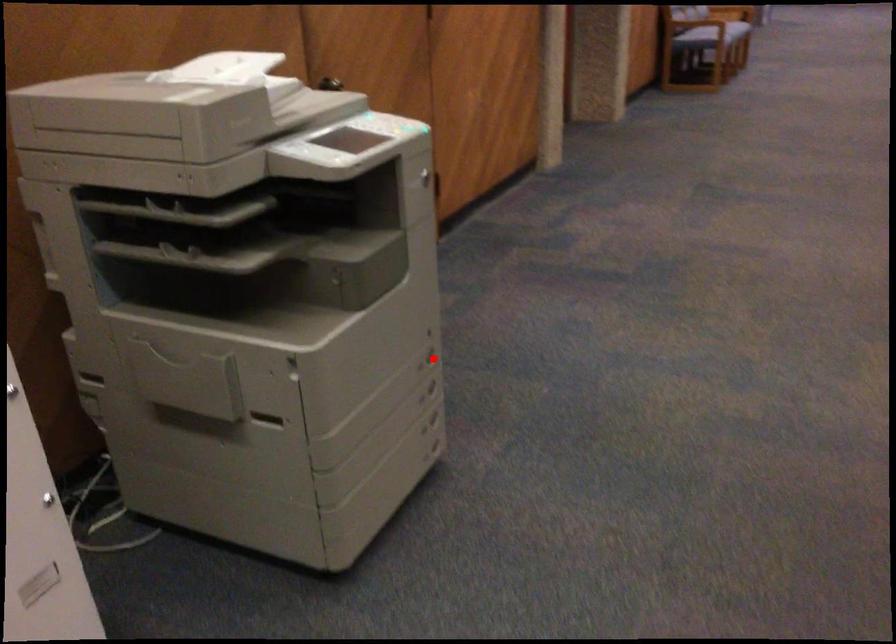
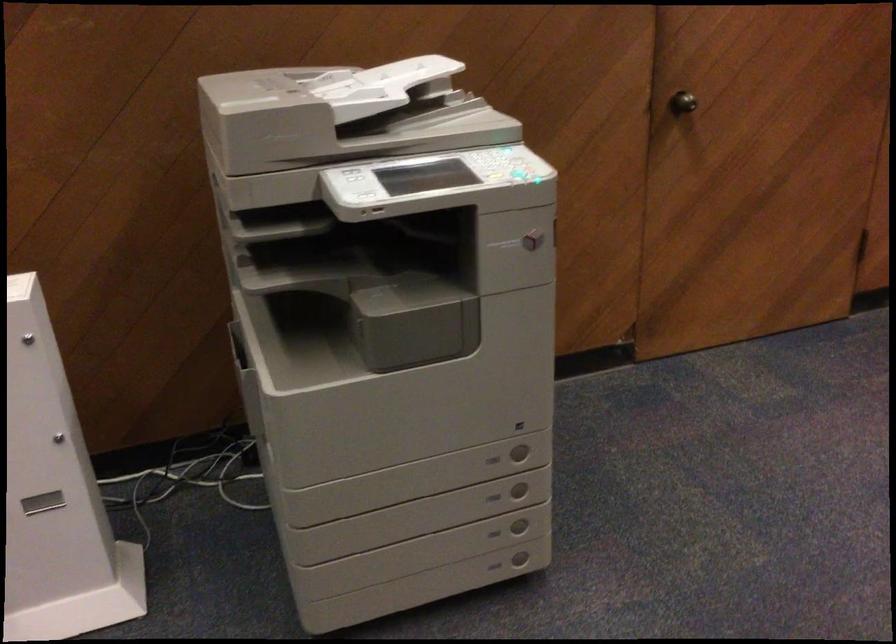
Question: A red point is marked in image1. In image2, is the corresponding 3D point closer to the camera or farther? Reply with the corresponding letter.

Choices:
 (A) The corresponding 3D point is closer.
 (B) The corresponding 3D point is farther.

Answer: (A)